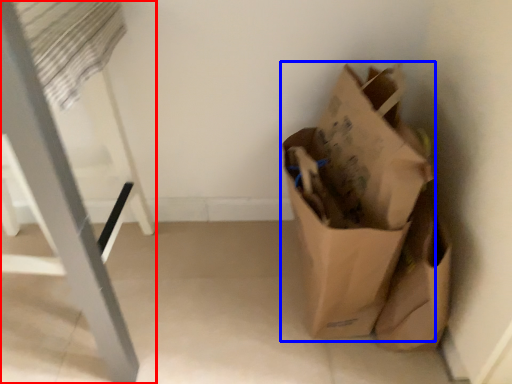
Question: Among these objects, which one is farthest to the camera, furniture (highlighted by a red box) or grocery bag (highlighted by a blue box)?

Choices:
 (A) furniture
 (B) grocery bag

Answer: (B)